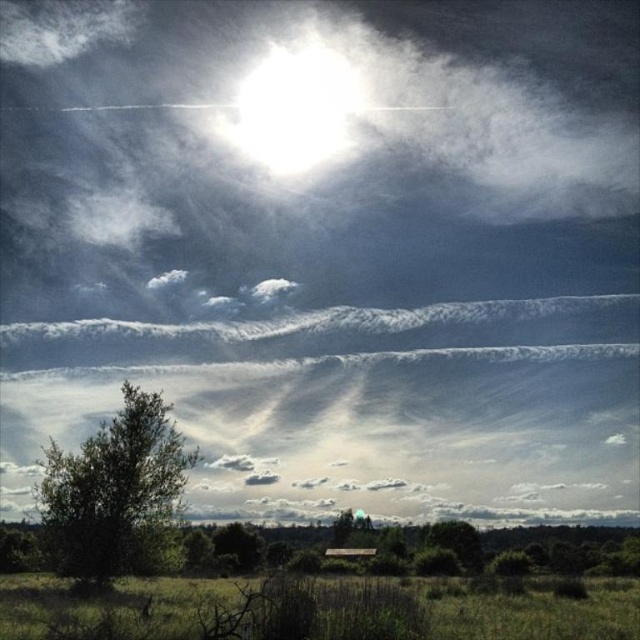
What do you see at coordinates (115, 492) in the screenshot? This screenshot has height=640, width=640. I see `green leafy tree at lower left` at bounding box center [115, 492].

Identify the location of green leafy tree at lower left. The height and width of the screenshot is (640, 640). (115, 492).

Which is behind, point (184, 465) or point (310, 147)?

The point (310, 147) is more distant.

Is green leafy tree at lower left bigger than white glossy sun at upper center?

Actually, green leafy tree at lower left might be smaller than white glossy sun at upper center.

Locate an element on the screen. The width and height of the screenshot is (640, 640). green leafy tree at lower left is located at coordinates (115, 492).

Which of these two, green grassy field at lower center or white glossy sun at upper center, stands taller?

white glossy sun at upper center

Between point (588, 627) and point (342, 108), which one is positioned in front?

Positioned in front is point (588, 627).

Identify the location of green grassy field at lower center. (538, 612).